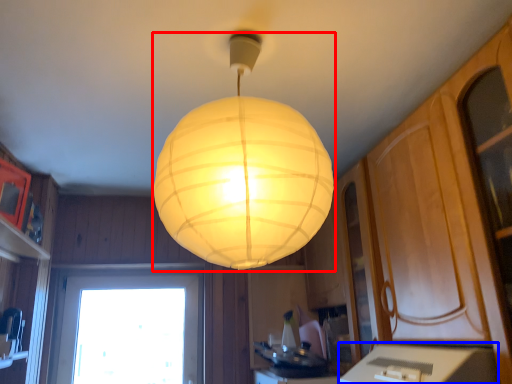
Question: Which object appears farthest to the camera in this image, lamp (highlighted by a red box) or counter top (highlighted by a blue box)?

Choices:
 (A) lamp
 (B) counter top

Answer: (B)